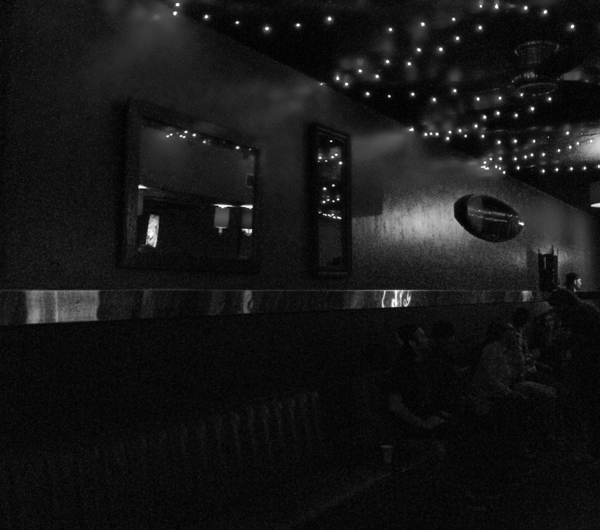
At what (x,y) coordinates should I click in order to perform the action: click on fairy lights. Please return your answer as a coordinate pair (x, y). Looking at the image, I should click on (392, 66), (459, 132), (507, 162).